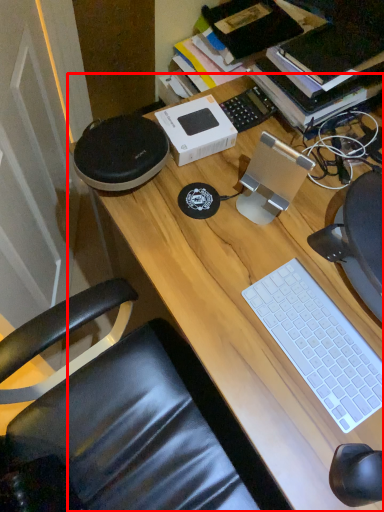
Question: From the image's perspective, where is desk (annotated by the red box) located relative to computer keyboard?

Choices:
 (A) below
 (B) above

Answer: (A)